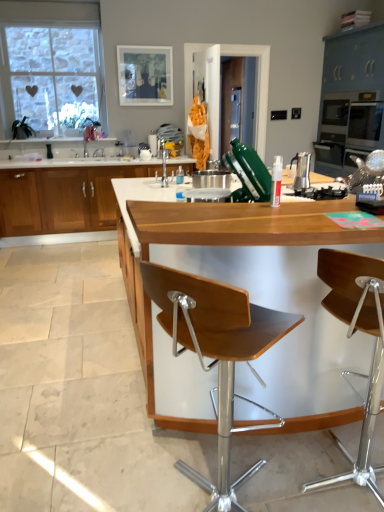
Question: Would you say wooden seat at center, arranged as the first chair when viewed from the left, is to the left or to the right of wooden at center, which is counted as the first countertop, starting from the bottom, in the picture?

Choices:
 (A) left
 (B) right

Answer: (A)

Question: From the image's perspective, relative to wooden at center, the first countertop from the front, is wooden seat at center, arranged as the first chair when viewed from the left, above or below?

Choices:
 (A) below
 (B) above

Answer: (A)

Question: Considering the real-world distances, which object is farthest from the white glossy countertop at center, which ranks as the 1th countertop in back-to-front order?

Choices:
 (A) wooden seat at center, the 1th chair in the right-to-left sequence
 (B) wooden seat at center, acting as the 2th chair starting from the right
 (C) clear glass window at upper left
 (D) wooden cabinet at left, placed as the 2th cabinetry when sorted from right to left
 (E) matte gray cabinetry at upper right, the second cabinetry in the left-to-right sequence

Answer: (A)

Question: Estimate the real-world distances between objects in this image. Which object is farther from the clear glass window at upper left?

Choices:
 (A) white glossy countertop at center, which ranks as the 1th countertop in back-to-front order
 (B) satin silver espresso maker at center
 (C) matte gray cabinetry at upper right, which is counted as the 1th cabinetry, starting from the right
 (D) wooden seat at center, acting as the 2th chair starting from the right
 (E) wooden seat at center, the 1th chair in the right-to-left sequence

Answer: (E)